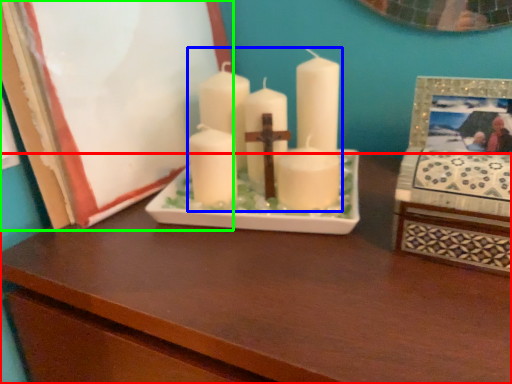
Question: Considering the real-world distances, which object is closest to table (highlighted by a red box)? candle (highlighted by a blue box) or picture frame (highlighted by a green box).

Choices:
 (A) candle
 (B) picture frame

Answer: (A)